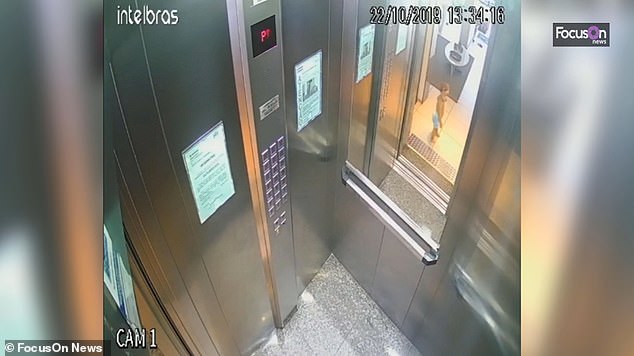
What are the coordinates of `elevator` in the screenshot? It's located at (302, 266).